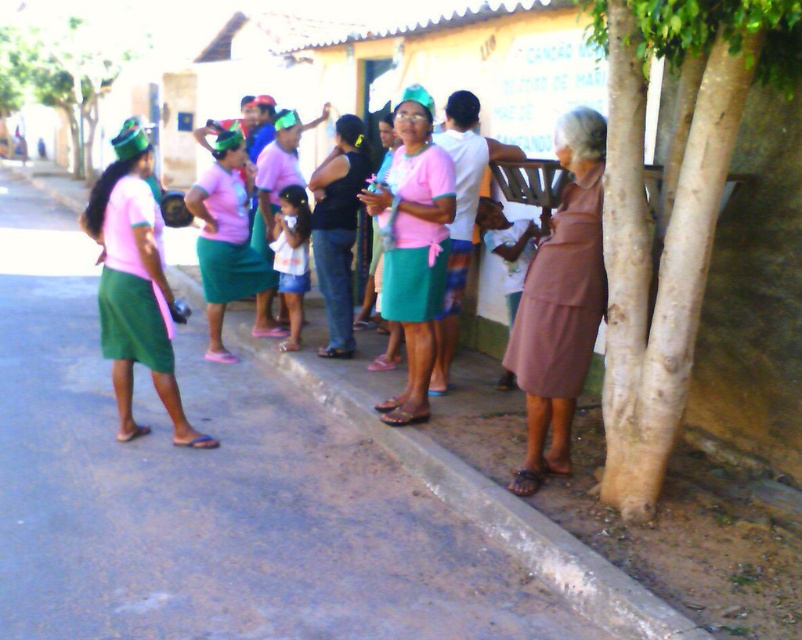
Question: Considering the relative positions of matte pink dress at center and matte pink skirt at center in the image provided, where is matte pink dress at center located with respect to matte pink skirt at center?

Choices:
 (A) right
 (B) left

Answer: (A)

Question: Which point appears farthest from the camera in this image?

Choices:
 (A) (314, 170)
 (B) (428, 195)

Answer: (A)

Question: Estimate the real-world distances between objects in this image. Which object is farther from the matte pink skirt at center?

Choices:
 (A) matte pink skirt at left
 (B) white smooth tree trunk at right
 (C) matte pink shirt at left
 (D) brown fabric dress at lower right

Answer: (B)

Question: Does brown fabric dress at lower right appear on the right side of matte pink skirt at center?

Choices:
 (A) yes
 (B) no

Answer: (A)

Question: Which object is farther from the camera taking this photo?

Choices:
 (A) concrete at lower center
 (B) brown fabric dress at lower right
 (C) pink matte skirt at center
 (D) white smooth tree trunk at right

Answer: (C)

Question: Can you confirm if brown fabric dress at lower right is smaller than matte pink shirt at center?

Choices:
 (A) yes
 (B) no

Answer: (A)